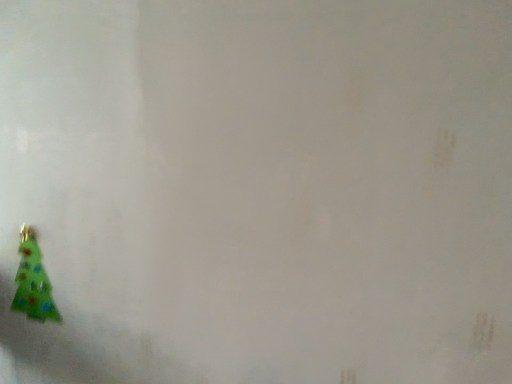
What do you see at coordinates (33, 281) in the screenshot? I see `green glossy christmas tree at lower left` at bounding box center [33, 281].

Locate an element on the screen. The width and height of the screenshot is (512, 384). green glossy christmas tree at lower left is located at coordinates (33, 281).

The image size is (512, 384). I want to click on green glossy christmas tree at lower left, so click(33, 281).